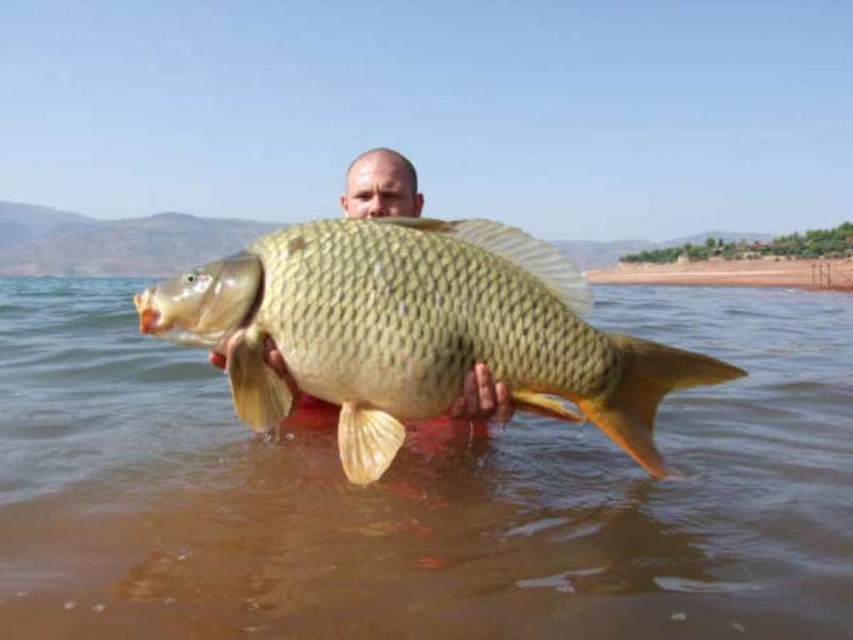
You are trying to determine the position of the shiny gold fish at center relative to the brown matte water at center. Based on the scene described, which object is positioned to the left?

The brown matte water at center is to the left of the shiny gold fish at center.